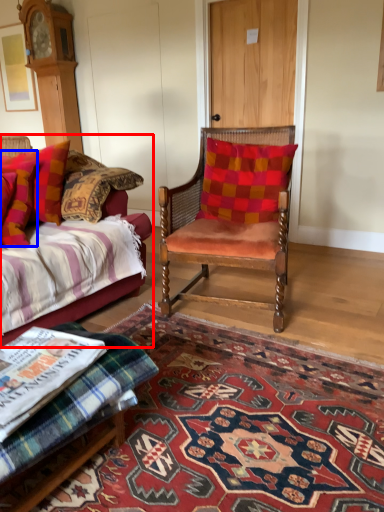
Question: Which object appears closest to the camera in this image, studio couch (highlighted by a red box) or pillow (highlighted by a blue box)?

Choices:
 (A) studio couch
 (B) pillow

Answer: (A)